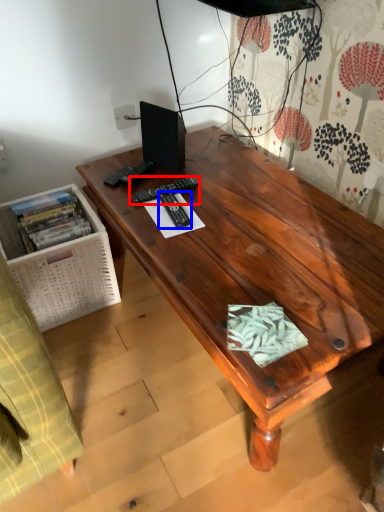
Question: Which point is further to the camera, remote control (highlighted by a red box) or remote control (highlighted by a blue box)?

Choices:
 (A) remote control
 (B) remote control

Answer: (A)